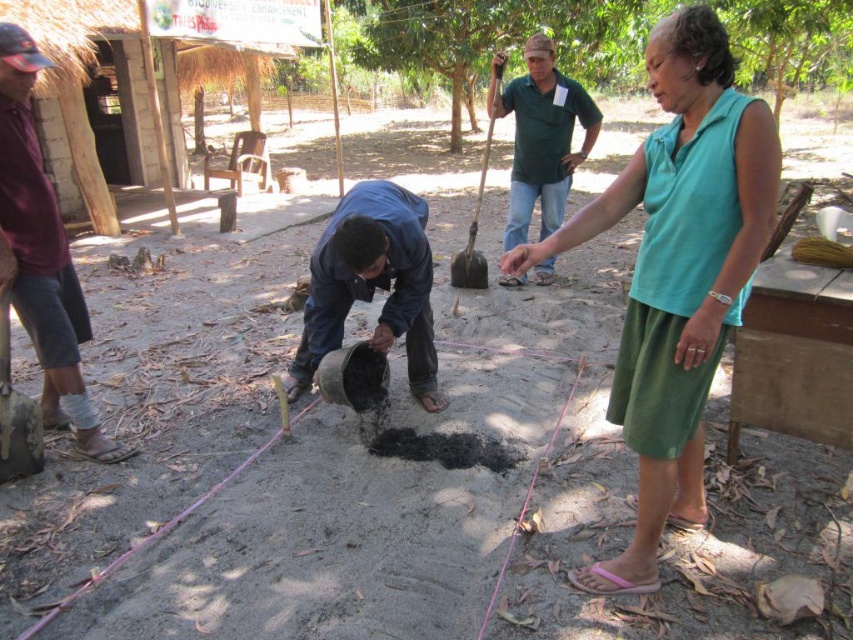
Does black matte cement at center appear under dark brown wooden shovel at upper center?

Yes, black matte cement at center is below dark brown wooden shovel at upper center.

Which of these two, black matte cement at center or dark brown wooden shovel at upper center, stands taller?

dark brown wooden shovel at upper center

Where is `black matte cement at center`? The width and height of the screenshot is (853, 640). black matte cement at center is located at coordinates (386, 483).

The width and height of the screenshot is (853, 640). What do you see at coordinates (44, 253) in the screenshot?
I see `maroon fabric shirt at left` at bounding box center [44, 253].

Can you confirm if maroon fabric shirt at left is positioned below dark brown wooden shovel at upper center?

Yes.

Where is `maroon fabric shirt at left`? This screenshot has height=640, width=853. maroon fabric shirt at left is located at coordinates (44, 253).

Is black matte cement at center positioned before maroon fabric shirt at left?

Yes, black matte cement at center is in front of maroon fabric shirt at left.

Is black matte cement at center smaller than maroon fabric shirt at left?

Actually, black matte cement at center might be larger than maroon fabric shirt at left.

Does point (401, 460) come behind point (38, 348)?

Yes, point (401, 460) is farther from viewer.

You are a GUI agent. You are given a task and a screenshot of the screen. Output one action in this format:
    pyautogui.click(x=<x>, y=<y>)
    Task: Click on the black matte cement at center
    
    Given the screenshot: What is the action you would take?
    pyautogui.click(x=386, y=483)